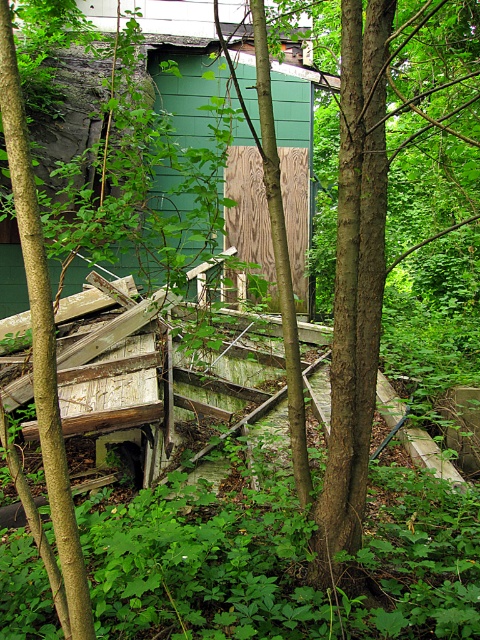
In the scene of an abandoned structure with green wood paneling at center and wooden panel at center, which object would require more space to store if you were to collect both?

The green wood paneling at center is larger in size than wooden panel at center, so it would require more space to store.